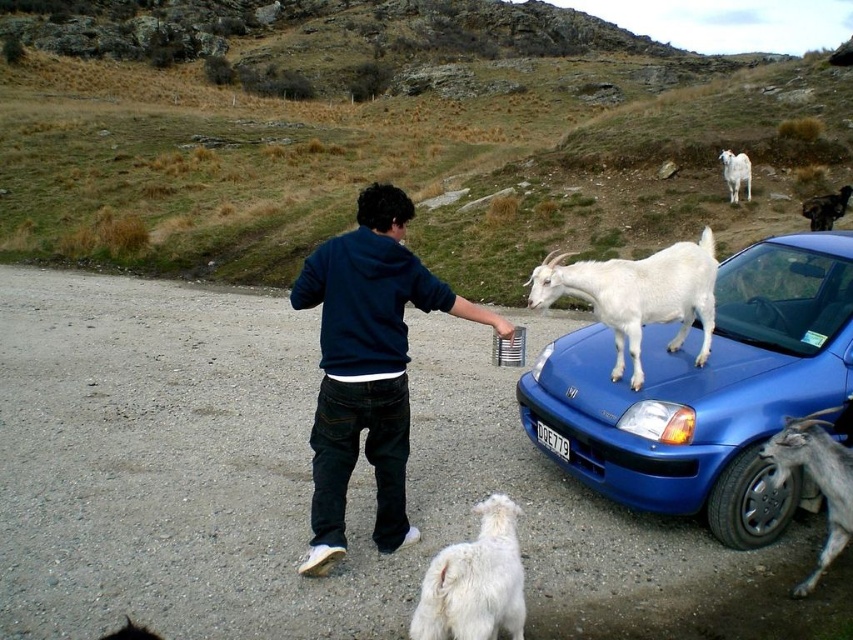
You are a photographer trying to capture a photo of the dark blue hoodie at center and the white fluffy goat at lower center. To ensure both are in focus, you need to know their vertical positions. Which object is higher up in the image?

The dark blue hoodie at center is located above the white fluffy goat at lower center, so the dark blue hoodie at center is higher up in the image.

From the picture: You are a photographer trying to capture a photo of the dark blue hoodie at center and the black fur dog at upper right. Since you want both subjects to appear equally prominent in the photo, which subject should you zoom in more on and why?

You should zoom in more on the black fur dog at upper right because it is smaller in size compared to the dark blue hoodie at center, as stated in the description that the dark blue hoodie at center is larger in size than the black fur dog at upper right. This adjustment will help balance their prominence in the photo.

You are a photographer trying to capture a photo of the white woolen goat at upper right and the black plastic license plate at center. If your camera can focus on objects within a 40 feet range, will both subjects be in focus?

The white woolen goat at upper right is 42.92 feet from the black plastic license plate at center. Since the distance between them exceeds the camera focus range of 40 feet, both subjects cannot be in focus simultaneously.